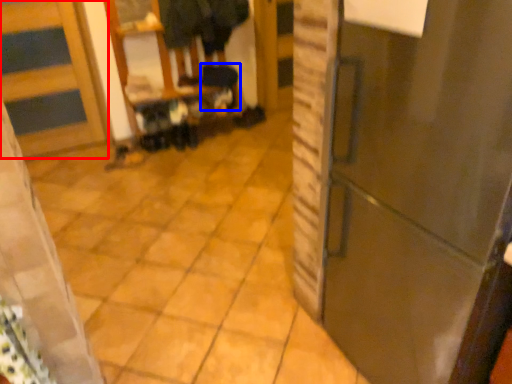
Question: Which point is further to the camera, door (highlighted by a red box) or step stool (highlighted by a blue box)?

Choices:
 (A) door
 (B) step stool

Answer: (B)